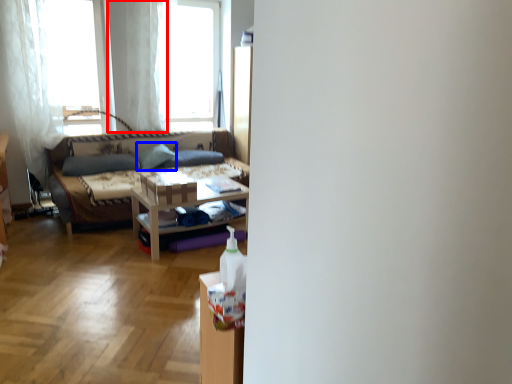
Question: Among these objects, which one is farthest to the camera, curtain (highlighted by a red box) or pillow (highlighted by a blue box)?

Choices:
 (A) curtain
 (B) pillow

Answer: (B)